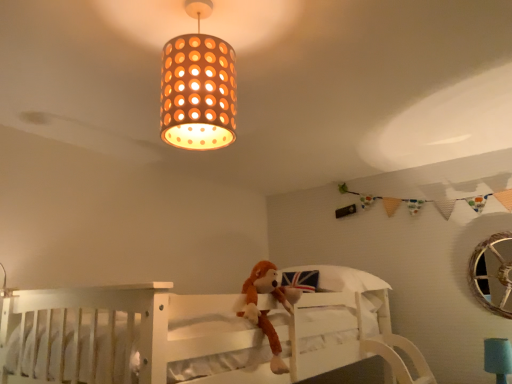
This screenshot has width=512, height=384. What are the coordinates of `brown plush monkey at center` in the screenshot? It's located at (267, 311).

Locate an element on the screen. This screenshot has width=512, height=384. orange perforated paper lampshade at upper center is located at coordinates (198, 88).

You are a GUI agent. You are given a task and a screenshot of the screen. Output one action in this format:
    pyautogui.click(x=<x>, y=<y>)
    Task: Click on the teal fabric lampshade at lower right
    The image size is (512, 384).
    Given the screenshot: What is the action you would take?
    pyautogui.click(x=498, y=358)

Which object is positioned more to the left, orange perforated paper lampshade at upper center or white wooden bunk bed at center?

orange perforated paper lampshade at upper center.

Is orange perforated paper lampshade at upper center thinner than white wooden bunk bed at center?

Yes.

Image resolution: width=512 pixels, height=384 pixels. Find the location of `lamp above the white wooden bunk bed at center (from a real-world perspective)`. lamp above the white wooden bunk bed at center (from a real-world perspective) is located at coordinates (198, 88).

Could you tell me if brown plush monkey at center is turned towards white wooden bunk bed at center?

Yes, brown plush monkey at center is facing white wooden bunk bed at center.

Can you confirm if brown plush monkey at center is taller than white wooden bunk bed at center?

In fact, brown plush monkey at center may be shorter than white wooden bunk bed at center.

Does brown plush monkey at center have a larger size compared to white wooden bunk bed at center?

No.

Find the location of a particular element. Image resolution: width=512 pixels, height=384 pixels. toy behind the white wooden bunk bed at center is located at coordinates (267, 311).

Which is behind, teal fabric lampshade at lower right or white wooden bunk bed at center?

teal fabric lampshade at lower right is behind.

Consider the image. From a real-world perspective, which is physically above, teal fabric lampshade at lower right or white wooden bunk bed at center?

From a 3D spatial view, white wooden bunk bed at center is above.

Visually, is teal fabric lampshade at lower right positioned to the left or to the right of white wooden bunk bed at center?

Clearly, teal fabric lampshade at lower right is on the right of white wooden bunk bed at center in the image.

Is teal fabric lampshade at lower right wider or thinner than white wooden bunk bed at center?

Clearly, teal fabric lampshade at lower right has less width compared to white wooden bunk bed at center.

Does orange perforated paper lampshade at upper center touch teal fabric lampshade at lower right?

orange perforated paper lampshade at upper center and teal fabric lampshade at lower right are not in contact.

Does orange perforated paper lampshade at upper center appear on the right side of teal fabric lampshade at lower right?

No.

Is orange perforated paper lampshade at upper center smaller than teal fabric lampshade at lower right?

Incorrect, orange perforated paper lampshade at upper center is not smaller in size than teal fabric lampshade at lower right.

From a real-world perspective, is orange perforated paper lampshade at upper center positioned above or below teal fabric lampshade at lower right?

orange perforated paper lampshade at upper center is situated higher than teal fabric lampshade at lower right in the real world.

At what (x,y) coordinates should I click in order to perform the action: click on table lamp lying on the right of orange perforated paper lampshade at upper center. Please return your answer as a coordinate pair (x, y). The height and width of the screenshot is (384, 512). Looking at the image, I should click on (498, 358).

From the image's perspective, between teal fabric lampshade at lower right and orange perforated paper lampshade at upper center, which one is located above?

Answer: orange perforated paper lampshade at upper center, from the image's perspective.

Is teal fabric lampshade at lower right beside orange perforated paper lampshade at upper center?

teal fabric lampshade at lower right and orange perforated paper lampshade at upper center are clearly separated.

In the image, is white wooden bunk bed at center on the left side or the right side of brown plush monkey at center?

From the image, it's evident that white wooden bunk bed at center is to the right of brown plush monkey at center.

At what (x,y) coordinates should I click in order to perform the action: click on toy behind the white wooden bunk bed at center. Please return your answer as a coordinate pair (x, y). Looking at the image, I should click on (267, 311).

Looking at this image, considering the relative sizes of white wooden bunk bed at center and brown plush monkey at center in the image provided, is white wooden bunk bed at center shorter than brown plush monkey at center?

Incorrect, the height of white wooden bunk bed at center does not fall short of that of brown plush monkey at center.

Between white wooden bunk bed at center and brown plush monkey at center, which one has larger size?

With larger size is white wooden bunk bed at center.

Is brown plush monkey at center not close to teal fabric lampshade at lower right?

Yes, brown plush monkey at center and teal fabric lampshade at lower right are located far from each other.

Which of these two, brown plush monkey at center or teal fabric lampshade at lower right, stands shorter?

Standing shorter between the two is teal fabric lampshade at lower right.

From the image's perspective, is brown plush monkey at center located above or below teal fabric lampshade at lower right?

Based on their image positions, brown plush monkey at center is located above teal fabric lampshade at lower right.

From a real-world perspective, is brown plush monkey at center physically above teal fabric lampshade at lower right?

Indeed, from a real-world perspective, brown plush monkey at center stands above teal fabric lampshade at lower right.

Find the location of a particular element. infant bed on the right of orange perforated paper lampshade at upper center is located at coordinates click(197, 334).

At what (x,y) coordinates should I click in order to perform the action: click on infant bed below the brown plush monkey at center (from the image's perspective). Please return your answer as a coordinate pair (x, y). This screenshot has width=512, height=384. Looking at the image, I should click on coord(197,334).

Considering their positions, is orange perforated paper lampshade at upper center positioned closer to brown plush monkey at center than teal fabric lampshade at lower right?

orange perforated paper lampshade at upper center is closer to brown plush monkey at center.

Estimate the real-world distances between objects in this image. Which object is further from teal fabric lampshade at lower right, white wooden bunk bed at center or brown plush monkey at center?

brown plush monkey at center.

Considering their positions, is white wooden bunk bed at center positioned further to brown plush monkey at center than orange perforated paper lampshade at upper center?

Among the two, orange perforated paper lampshade at upper center is located further to brown plush monkey at center.

Looking at the image, which one is located closer to brown plush monkey at center, white wooden bunk bed at center or teal fabric lampshade at lower right?

Based on the image, white wooden bunk bed at center appears to be nearer to brown plush monkey at center.

Looking at the image, which one is located further to orange perforated paper lampshade at upper center, white wooden bunk bed at center or brown plush monkey at center?

Based on the image, white wooden bunk bed at center appears to be further to orange perforated paper lampshade at upper center.

Considering their positions, is teal fabric lampshade at lower right positioned further to brown plush monkey at center than orange perforated paper lampshade at upper center?

teal fabric lampshade at lower right.

Which object lies further to the anchor point white wooden bunk bed at center, orange perforated paper lampshade at upper center or brown plush monkey at center?

orange perforated paper lampshade at upper center is positioned further to the anchor white wooden bunk bed at center.

When comparing their distances from white wooden bunk bed at center, does teal fabric lampshade at lower right or orange perforated paper lampshade at upper center seem closer?

orange perforated paper lampshade at upper center.

Locate an element on the screen. The width and height of the screenshot is (512, 384). toy that lies between orange perforated paper lampshade at upper center and white wooden bunk bed at center from top to bottom is located at coordinates (267, 311).

Image resolution: width=512 pixels, height=384 pixels. I want to click on toy between orange perforated paper lampshade at upper center and teal fabric lampshade at lower right in the horizontal direction, so click(267, 311).

The image size is (512, 384). I want to click on infant bed located between brown plush monkey at center and teal fabric lampshade at lower right in the left-right direction, so click(197, 334).

Locate an element on the screen. Image resolution: width=512 pixels, height=384 pixels. infant bed situated between orange perforated paper lampshade at upper center and teal fabric lampshade at lower right from left to right is located at coordinates (197, 334).